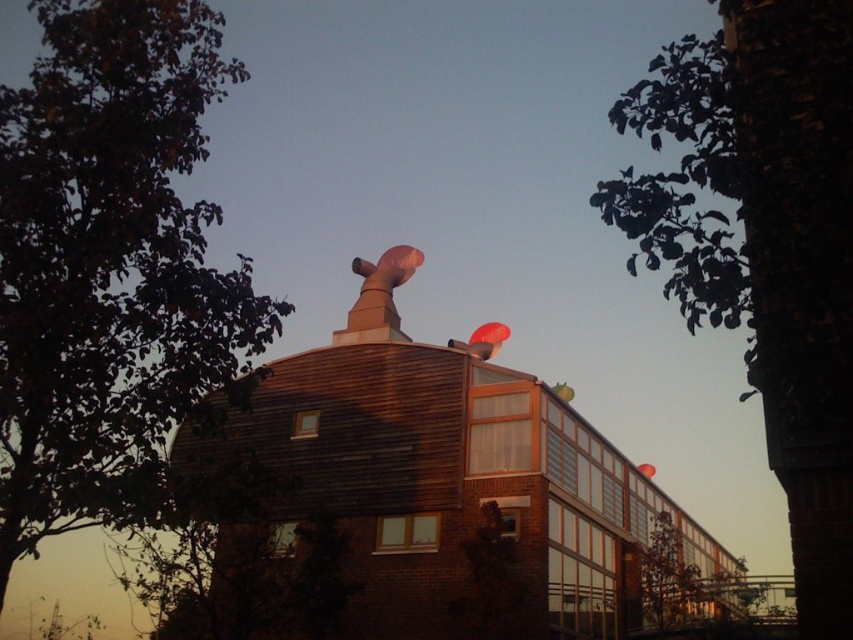
Question: Which object is positioned closest to the rubberized red balloon at upper center?

Choices:
 (A) rubber balloon at center
 (B) translucent plastic balloon at upper center

Answer: (B)

Question: Can you confirm if green matte tree at lower right is bigger than translucent plastic balloon at upper center?

Choices:
 (A) yes
 (B) no

Answer: (A)

Question: Which point is closer to the camera?

Choices:
 (A) green leafy tree at upper left
 (B) green matte tree at lower right

Answer: (A)

Question: Is green leafy tree at upper left to the left of translucent plastic balloon at upper center from the viewer's perspective?

Choices:
 (A) yes
 (B) no

Answer: (A)

Question: Which object is positioned closest to the green matte tree at lower right?

Choices:
 (A) translucent plastic balloon at upper center
 (B) rubber balloon at center
 (C) rubberized red balloon at upper center
 (D) green leafy tree at upper right

Answer: (A)

Question: Is green leafy tree at upper left to the left of green leafy tree at upper right from the viewer's perspective?

Choices:
 (A) no
 (B) yes

Answer: (B)